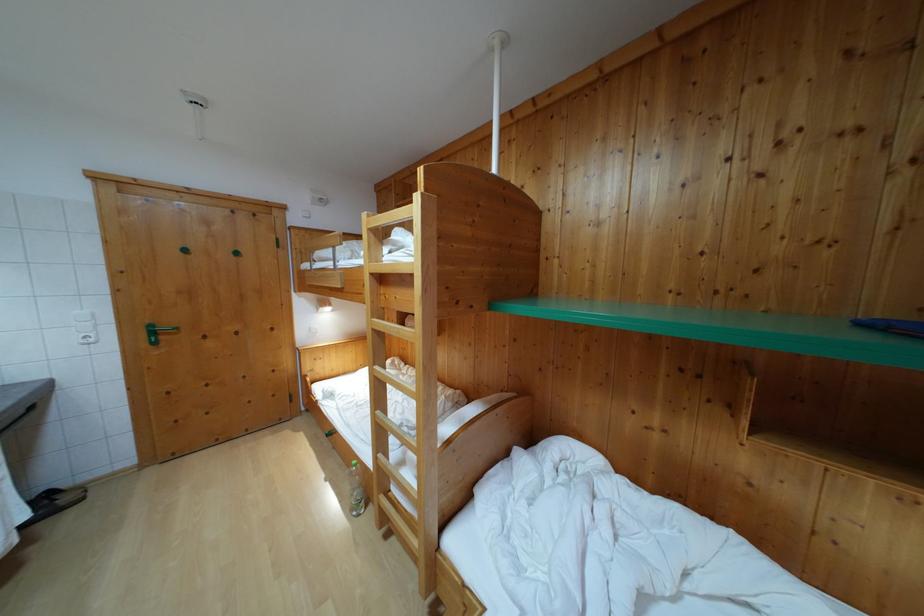
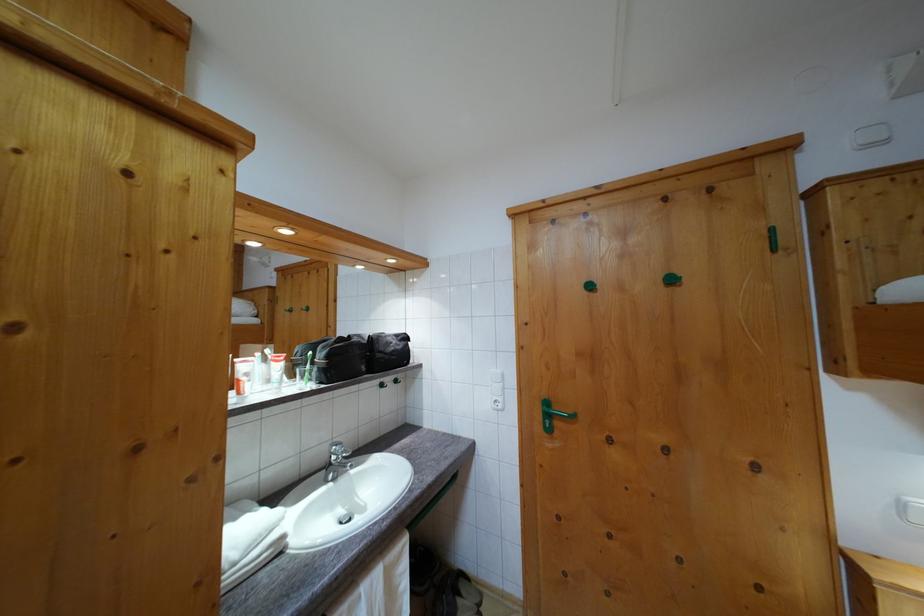
In the second image, find the point that corresponds to [189,257] in the first image.

(593, 294)